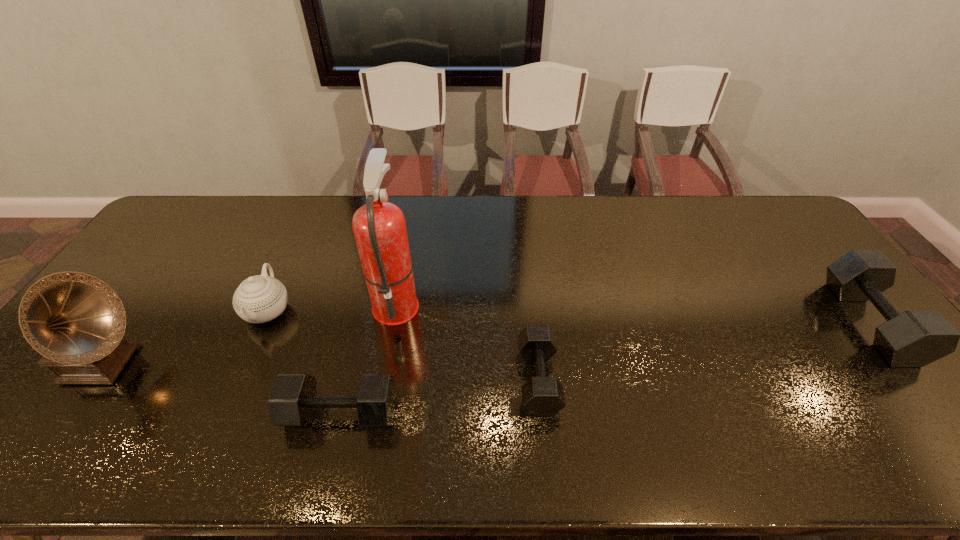
Please determine a free point for an extra dumbbell to ensure balance. Please provide its 2D coordinates. Your answer should be formatted as a tuple, i.e. [(x, y)], where the tuple contains the x and y coordinates of a point satisfying the conditions above.

[(713, 349)]